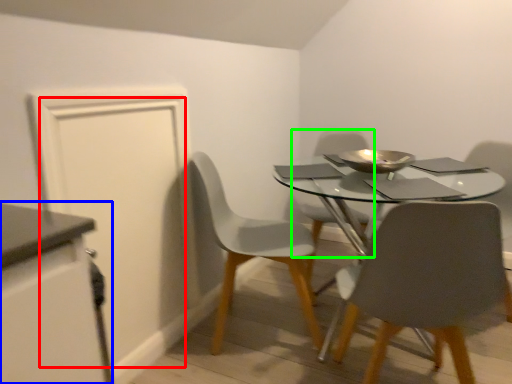
Question: Based on their relative distances, which object is nearer to door (highlighted by a red box)? Choose from cabinetry (highlighted by a blue box) and chair (highlighted by a green box).

Choices:
 (A) cabinetry
 (B) chair

Answer: (A)